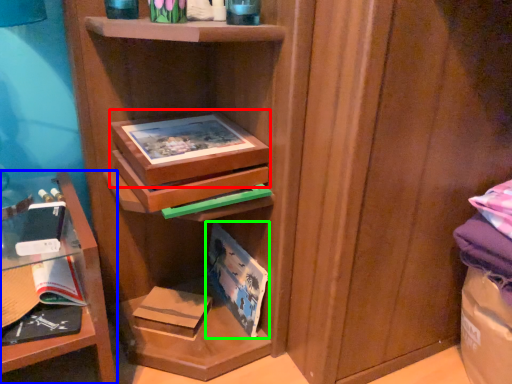
Question: Estimate the real-world distances between objects in this image. Which object is farther from box (highlighted by a red box), shelf (highlighted by a blue box) or paperback book (highlighted by a green box)?

Choices:
 (A) shelf
 (B) paperback book

Answer: (B)